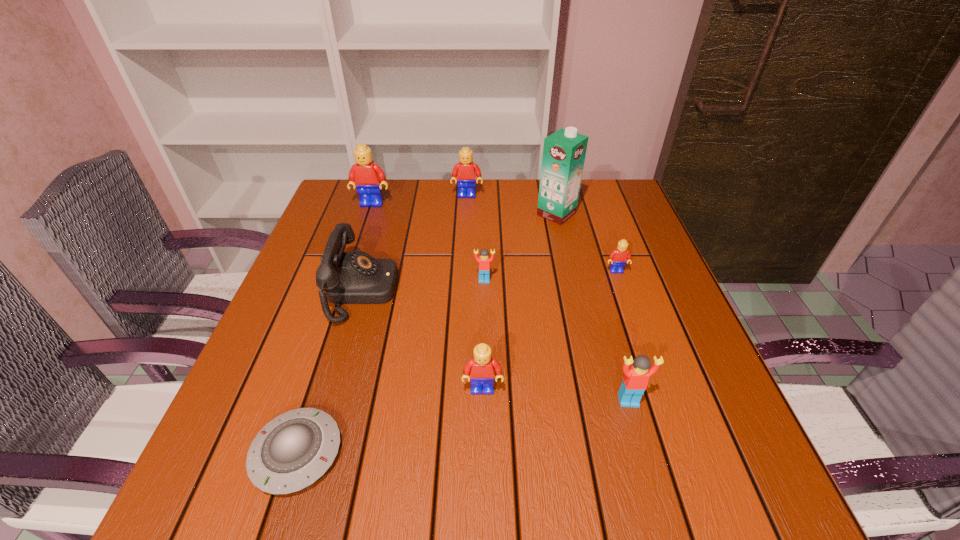
At what (x,y) coordinates should I click in order to perform the action: click on the left red Lego. Please return your answer as a coordinate pair (x, y). The height and width of the screenshot is (540, 960). Looking at the image, I should click on (484, 261).

This screenshot has width=960, height=540. I want to click on the third farthest yellow Lego, so click(x=618, y=257).

The width and height of the screenshot is (960, 540). What are the coordinates of `the smallest yellow Lego` in the screenshot? It's located at (618, 257).

What are the coordinates of `the nearest object` in the screenshot? It's located at (292, 451).

Locate an element on the screen. the shortest object is located at coordinates (292, 451).

Image resolution: width=960 pixels, height=540 pixels. In order to click on vacant point located 0.060m on the back of the tallest object in this screenshot , I will do `click(551, 192)`.

Locate an element on the screen. The image size is (960, 540). blank space located 0.310m on the front-facing side of the second tallest object is located at coordinates (347, 281).

Locate an element on the screen. The image size is (960, 540). free space located 0.140m on the front-facing side of the farthest object is located at coordinates (466, 227).

Image resolution: width=960 pixels, height=540 pixels. What are the coordinates of `free space located on the dial of the gray telephone` in the screenshot? It's located at 430,291.

I want to click on blank space located on the face of the bigger red Lego, so click(646, 463).